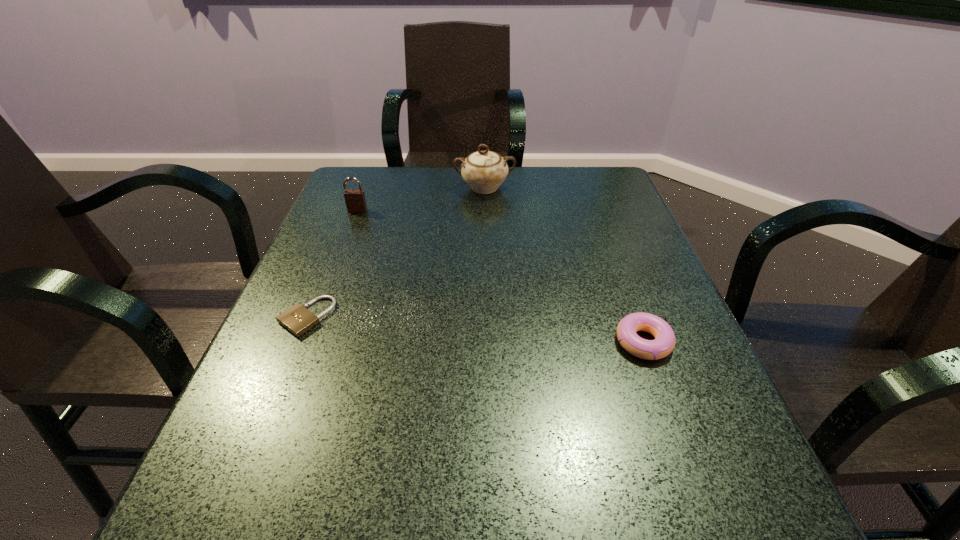
The height and width of the screenshot is (540, 960). Find the location of `empty space that is in between the nearer padlock and the taller padlock`. empty space that is in between the nearer padlock and the taller padlock is located at coordinates (332, 264).

Locate an element on the screen. This screenshot has height=540, width=960. vacant space in between the rightmost object and the nearer padlock is located at coordinates [x=475, y=329].

Locate an element on the screen. the second closest object to the third tallest object is located at coordinates [x=298, y=319].

This screenshot has width=960, height=540. What are the coordinates of `the second closest object to the second farthest object` in the screenshot? It's located at (298, 319).

Locate an element on the screen. This screenshot has height=540, width=960. vacant space that satisfies the following two spatial constraints: 1. on the front-facing side of the farther padlock; 2. on the left side of the rightmost object is located at coordinates (307, 342).

The width and height of the screenshot is (960, 540). In order to click on free location that satisfies the following two spatial constraints: 1. on the front side of the farthest object; 2. on the right side of the third tallest object in this screenshot , I will do `click(487, 342)`.

I want to click on free spot that satisfies the following two spatial constraints: 1. on the front side of the nearer padlock; 2. on the right side of the third tallest object, so click(x=297, y=342).